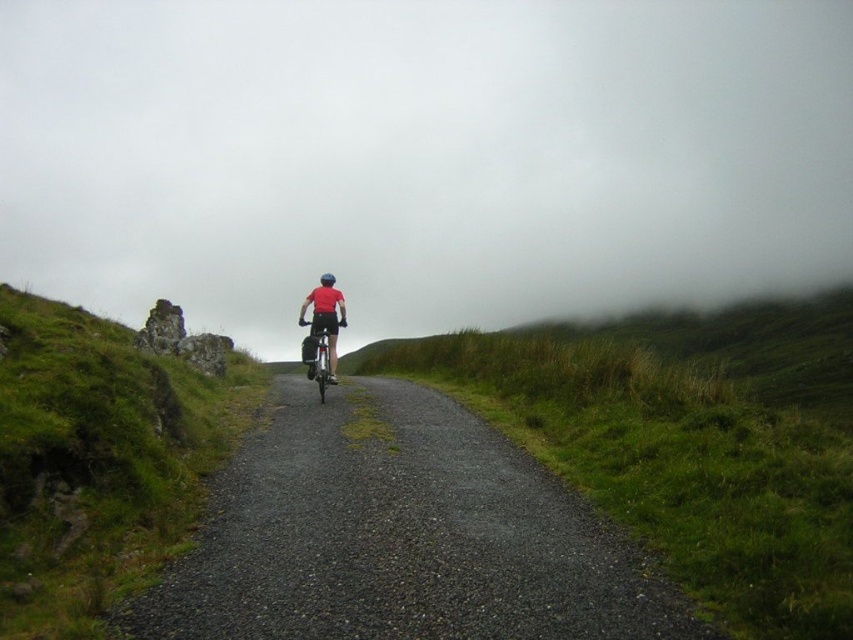
Does gravel road at center have a greater width compared to shiny metallic bicycle at center?

In fact, gravel road at center might be narrower than shiny metallic bicycle at center.

Can you confirm if gravel road at center is positioned to the left of shiny metallic bicycle at center?

Incorrect, gravel road at center is not on the left side of shiny metallic bicycle at center.

Is point (461, 616) less distant than point (308, 372)?

Yes, it is.

I want to click on gravel road at center, so click(399, 536).

The image size is (853, 640). Describe the element at coordinates (399, 536) in the screenshot. I see `gravel road at center` at that location.

At what (x,y) coordinates should I click in order to perform the action: click on gravel road at center. Please return your answer as a coordinate pair (x, y). Image resolution: width=853 pixels, height=640 pixels. Looking at the image, I should click on (399, 536).

Is white foggy cloud at upper center above gravel road at center?

Yes, white foggy cloud at upper center is above gravel road at center.

Which is more to the left, white foggy cloud at upper center or gravel road at center?

white foggy cloud at upper center

Is point (320, 148) closer to viewer compared to point (532, 497)?

No, it is behind (532, 497).

Where is `white foggy cloud at upper center`? white foggy cloud at upper center is located at coordinates (422, 156).